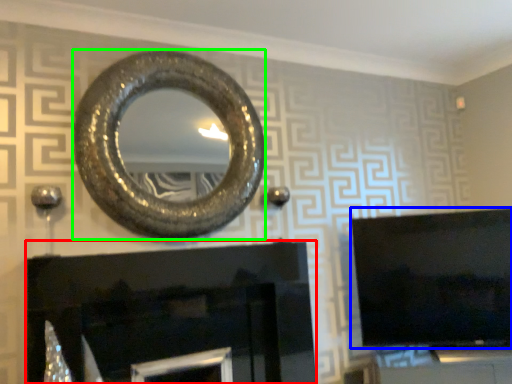
Question: Estimate the real-world distances between objects in this image. Which object is farther from fireplace (highlighted by a red box), television (highlighted by a blue box) or oval (highlighted by a green box)?

Choices:
 (A) television
 (B) oval

Answer: (A)